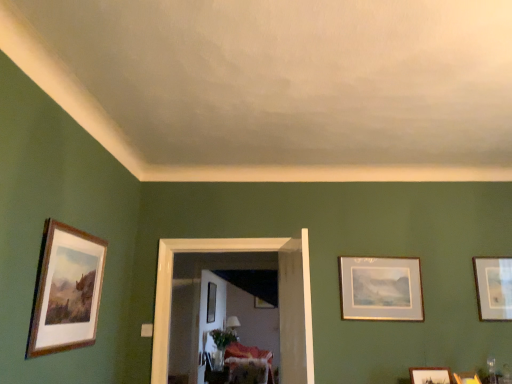
Question: Does velvet floral sofa at center lie behind wooden picture frame at center, the 3th picture frame when ordered from left to right?

Choices:
 (A) yes
 (B) no

Answer: (B)

Question: Does velvet floral sofa at center have a greater width compared to wooden picture frame at center, marked as the first picture frame in a back-to-front arrangement?

Choices:
 (A) no
 (B) yes

Answer: (B)

Question: From the image's perspective, would you say velvet floral sofa at center is positioned over wooden picture frame at center, arranged as the seventh picture frame when viewed from the front?

Choices:
 (A) no
 (B) yes

Answer: (A)

Question: Would you say velvet floral sofa at center is a long distance from wooden picture frame at center, the 3th picture frame when ordered from left to right?

Choices:
 (A) no
 (B) yes

Answer: (A)

Question: Considering the relative sizes of velvet floral sofa at center and wooden picture frame at center, the 3th picture frame when ordered from left to right, in the image provided, is velvet floral sofa at center taller than wooden picture frame at center, the 3th picture frame when ordered from left to right,?

Choices:
 (A) no
 (B) yes

Answer: (B)

Question: Does point (54, 311) appear closer or farther from the camera than point (419, 374)?

Choices:
 (A) farther
 (B) closer

Answer: (B)

Question: Looking at the image, does wooden frame at left, the 7th picture frame viewed from the back, seem bigger or smaller compared to wooden frame at upper right, acting as the 5th picture frame starting from the back?

Choices:
 (A) big
 (B) small

Answer: (A)

Question: From the image's perspective, is wooden frame at left, the seventh picture frame positioned from the bottom, above or below wooden frame at upper right, which appears as the 3th picture frame when viewed from the front?

Choices:
 (A) above
 (B) below

Answer: (A)

Question: Is wooden frame at left, which is the first picture frame from top to bottom, wider or thinner than wooden frame at upper right, which ranks as the 3th picture frame in right-to-left order?

Choices:
 (A) wide
 (B) thin

Answer: (B)

Question: In terms of size, does translucent glass vase at center appear bigger or smaller than velvet floral sofa at center?

Choices:
 (A) big
 (B) small

Answer: (B)

Question: From a real-world perspective, is translucent glass vase at center above or below velvet floral sofa at center?

Choices:
 (A) above
 (B) below

Answer: (A)

Question: In terms of width, does translucent glass vase at center look wider or thinner when compared to velvet floral sofa at center?

Choices:
 (A) thin
 (B) wide

Answer: (A)

Question: Considering the positions of point (224, 336) and point (227, 365), is point (224, 336) closer or farther from the camera than point (227, 365)?

Choices:
 (A) farther
 (B) closer

Answer: (A)

Question: Considering the relative positions of wooden picture frame at lower right, arranged as the 6th picture frame when viewed from the back, and velvet floral sofa at center in the image provided, is wooden picture frame at lower right, arranged as the 6th picture frame when viewed from the back, to the left or to the right of velvet floral sofa at center?

Choices:
 (A) right
 (B) left

Answer: (A)

Question: Is wooden picture frame at lower right, which ranks as the 2th picture frame in front-to-back order, taller or shorter than velvet floral sofa at center?

Choices:
 (A) tall
 (B) short

Answer: (B)